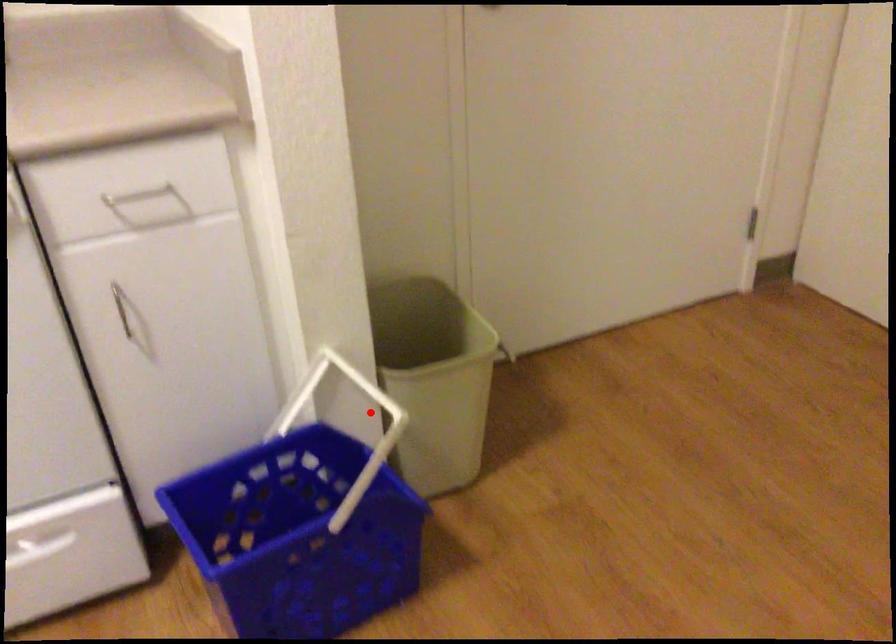
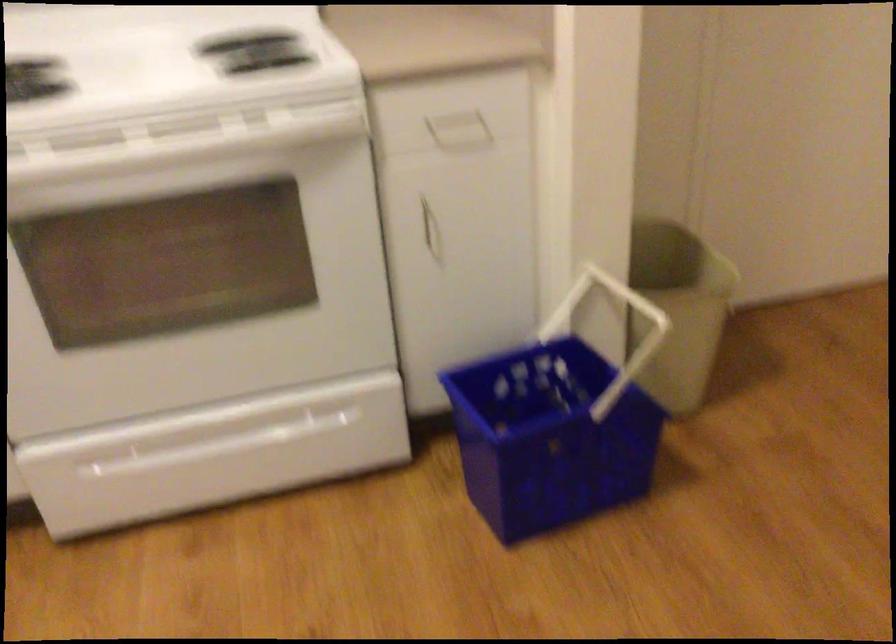
Question: I am providing you with two images of the same scene from different viewpoints. Given a red point in image1, look at the same physical point in image2. Is it:

Choices:
 (A) Closer to the viewpoint
 (B) Farther from the viewpoint

Answer: (B)